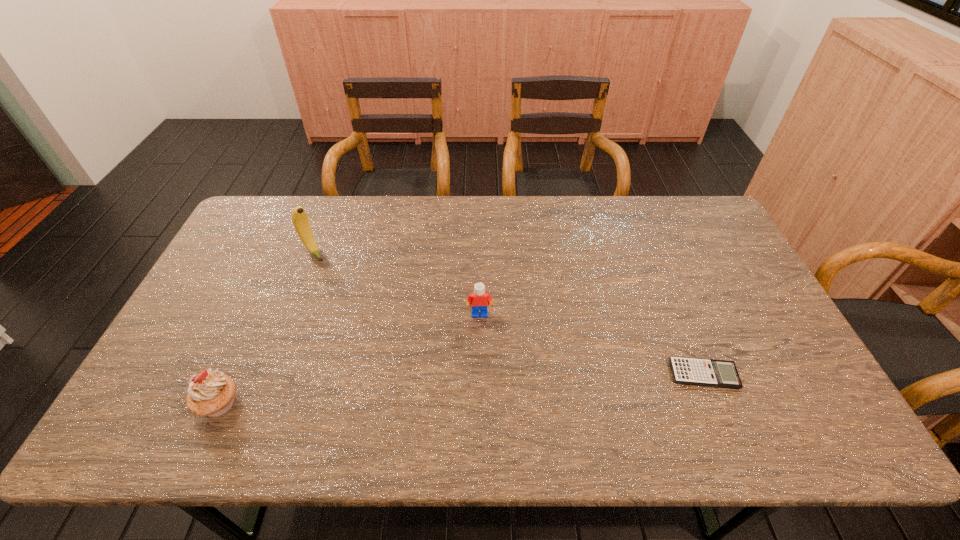
Image resolution: width=960 pixels, height=540 pixels. Find the location of `free spot on the desktop that is between the cupcake and the rightmost object and is positioned on the face of the second farthest object`. free spot on the desktop that is between the cupcake and the rightmost object and is positioned on the face of the second farthest object is located at coordinates (483, 388).

Find the location of a particular element. free spot on the desktop that is between the cupcake and the calculator and is positioned from the stem of the farthest object is located at coordinates (431, 390).